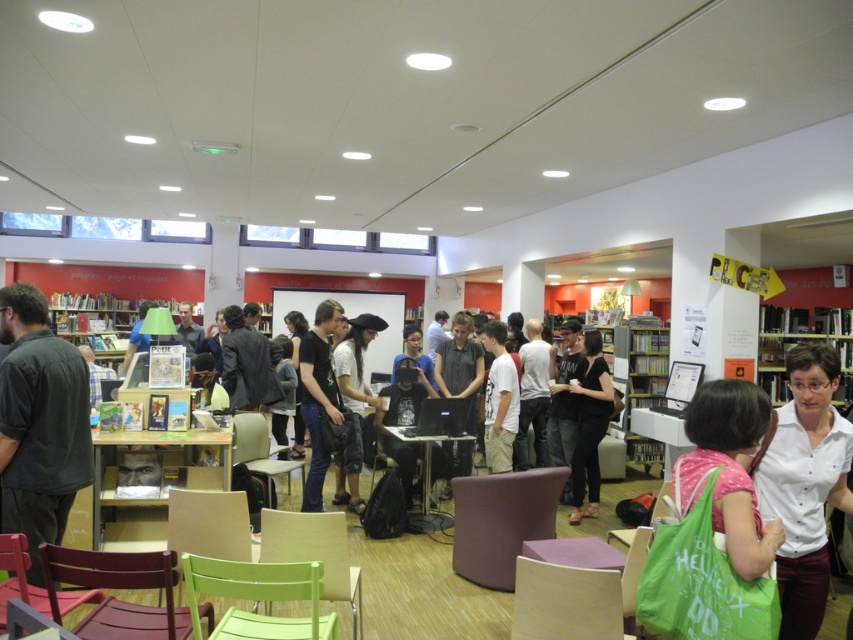
You are a photographer standing in the middle of the bookstore. You want to take a photo of the white matte shirt at center and the black matte hat at center without any overlap between them. Is it possible based on their sizes?

The white matte shirt at center might be wider than black matte hat at center, so there is a possibility that they might overlap in the photo if they are positioned closely. However, without exact measurements, it is uncertain. To ensure no overlap, adjust their positions or the camera angle accordingly.